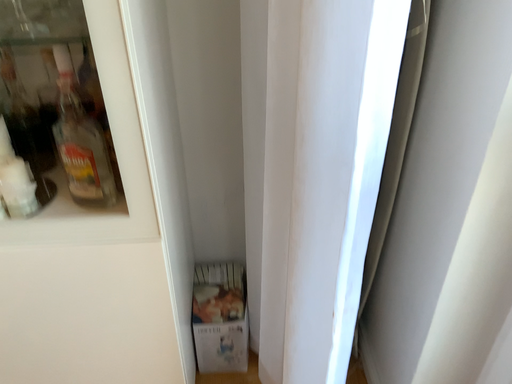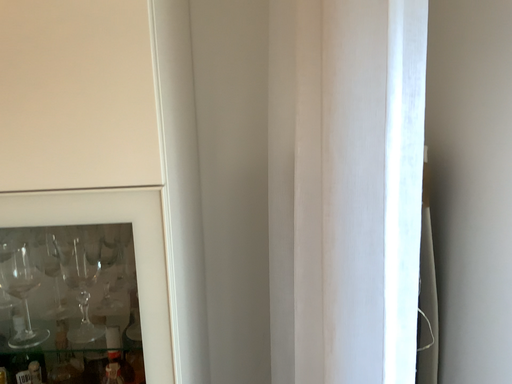
Question: How did the camera likely rotate when shooting the video?

Choices:
 (A) rotated upward
 (B) rotated downward

Answer: (A)